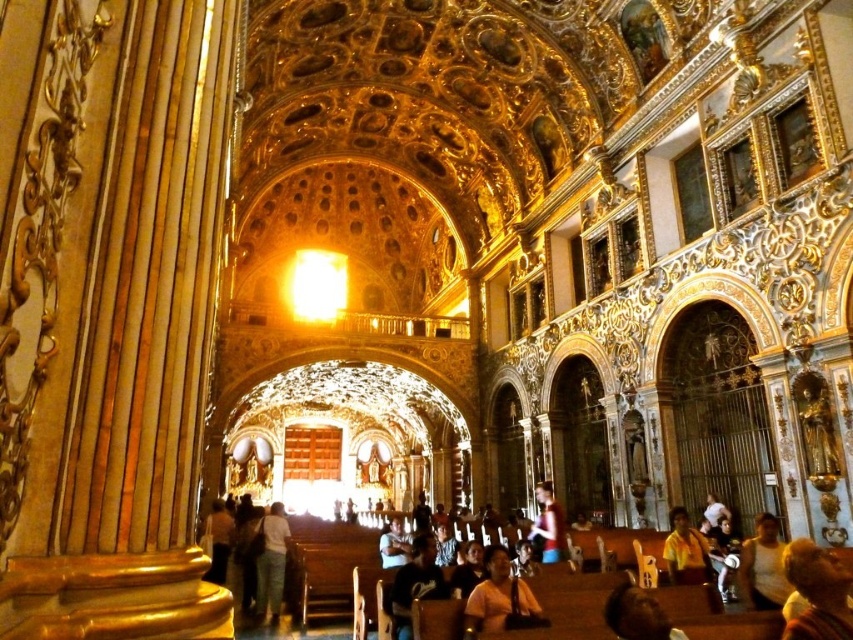
Question: Which of the following is the closest to the observer?

Choices:
 (A) (543, 524)
 (B) (412, 573)

Answer: (B)

Question: Can you confirm if yellow fabric shirt at lower right is smaller than light blue denim shirt at center?

Choices:
 (A) no
 (B) yes

Answer: (B)

Question: Does light beige fabric at lower center lie behind light blue denim shirt at center?

Choices:
 (A) yes
 (B) no

Answer: (A)

Question: Is yellow fabric shirt at lower right closer to the viewer compared to light brown leather jacket at center?

Choices:
 (A) yes
 (B) no

Answer: (A)

Question: Which point is closer to the camera?

Choices:
 (A) (281, 550)
 (B) (680, 637)
 (C) (840, 582)

Answer: (B)

Question: Which point is closer to the camera?

Choices:
 (A) yellow fabric shirt at lower right
 (B) smooth brown hair at lower right

Answer: (B)